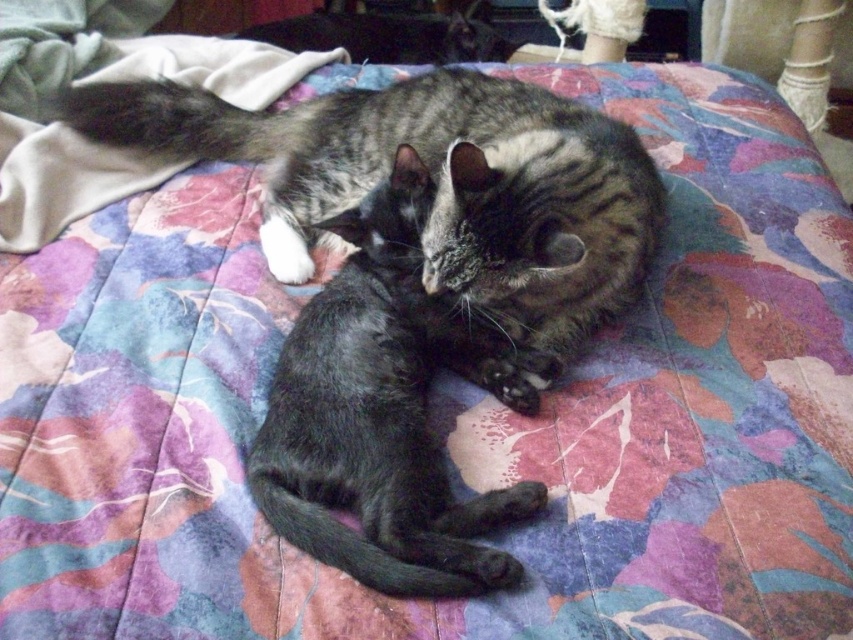
Question: Which object appears farthest from the camera in this image?

Choices:
 (A) tabby fur cat at center
 (B) shiny black cat at center

Answer: (A)

Question: Is tabby fur cat at center wider than shiny black cat at center?

Choices:
 (A) yes
 (B) no

Answer: (A)

Question: Can you confirm if tabby fur cat at center is positioned below shiny black cat at center?

Choices:
 (A) yes
 (B) no

Answer: (B)

Question: Which object is closer to the camera taking this photo?

Choices:
 (A) tabby fur cat at center
 (B) shiny black cat at center

Answer: (B)

Question: Is tabby fur cat at center to the right of shiny black cat at center from the viewer's perspective?

Choices:
 (A) yes
 (B) no

Answer: (B)